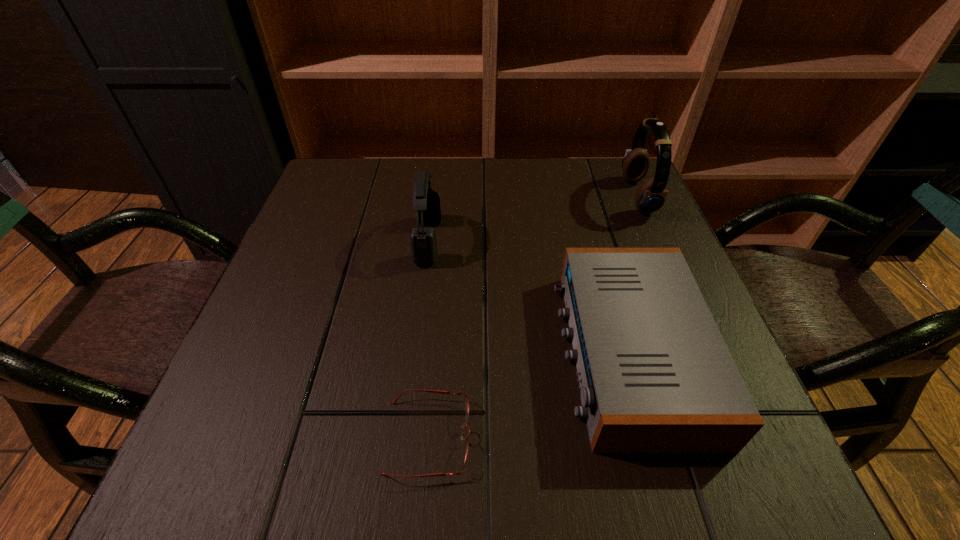
Where is `vacant space located 0.070m on the front panel of the second shortest object`? Image resolution: width=960 pixels, height=540 pixels. vacant space located 0.070m on the front panel of the second shortest object is located at coordinates (522, 353).

Image resolution: width=960 pixels, height=540 pixels. I want to click on free region located 0.360m on the front panel of the second shortest object, so click(x=350, y=353).

Locate an element on the screen. vacant space located on the front panel of the second shortest object is located at coordinates (474, 353).

This screenshot has width=960, height=540. What are the coordinates of `free location located 0.130m on the lenses of the spectacles` in the screenshot? It's located at (560, 437).

Locate an element on the screen. The width and height of the screenshot is (960, 540). object at the far edge is located at coordinates (651, 195).

The width and height of the screenshot is (960, 540). In order to click on radio receiver located at the near edge in this screenshot , I will do `click(656, 376)`.

Where is `spectacles that is positioned at the near edge`? This screenshot has height=540, width=960. spectacles that is positioned at the near edge is located at coordinates (433, 391).

Locate an element on the screen. headset located at the right edge is located at coordinates (651, 195).

What are the coordinates of `radio receiver that is at the right edge` in the screenshot? It's located at (656, 376).

The image size is (960, 540). I want to click on object positioned at the far right corner, so click(651, 195).